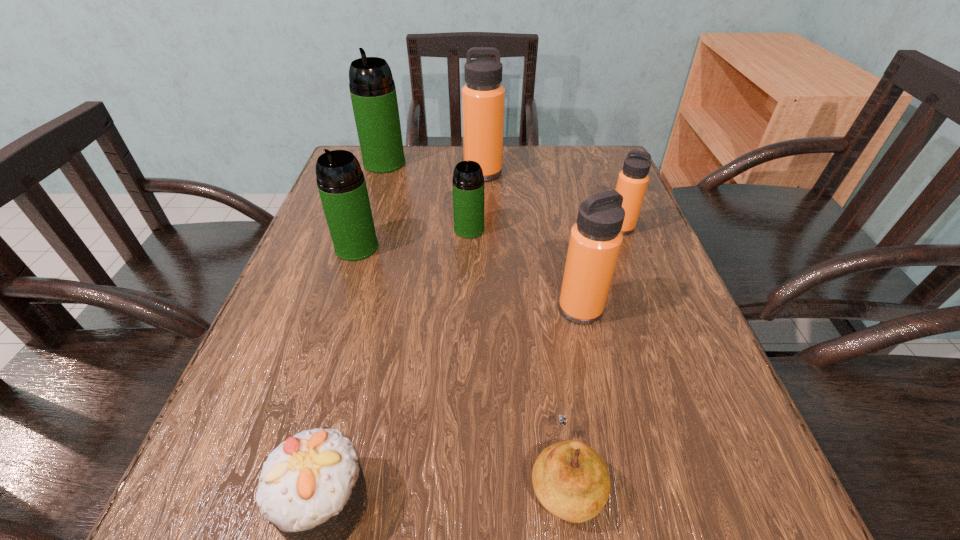
Find the location of a particular element. This screenshot has height=540, width=960. vacant space situated from the spout of the biggest green thermos bottle is located at coordinates (360, 238).

Identify the location of vacant space located on the right of the leftmost orange thermos bottle. (584, 173).

The width and height of the screenshot is (960, 540). I want to click on vacant region located 0.070m from the spout of the second biggest green thermos bottle, so click(x=345, y=286).

Where is `free space located on the left of the second biggest orange thermos bottle`? This screenshot has height=540, width=960. free space located on the left of the second biggest orange thermos bottle is located at coordinates (497, 309).

Image resolution: width=960 pixels, height=540 pixels. I want to click on free space located from the spout of the smallest green thermos bottle, so click(x=468, y=264).

Image resolution: width=960 pixels, height=540 pixels. I want to click on vacant region located 0.160m on the front of the rightmost orange thermos bottle, so click(644, 288).

Identify the location of vacant space located 0.270m on the back of the pear. Image resolution: width=960 pixels, height=540 pixels. (539, 296).

Find the location of a particular element. Image resolution: width=960 pixels, height=540 pixels. object situated at the near edge is located at coordinates (571, 480).

What are the coordinates of `object positioned at the far left corner` in the screenshot? It's located at (373, 94).

In the image, there is a desktop. At what (x,y) coordinates should I click in order to perform the action: click on vacant space at the far edge. Please return your answer as a coordinate pair (x, y). The width and height of the screenshot is (960, 540). Looking at the image, I should click on (528, 187).